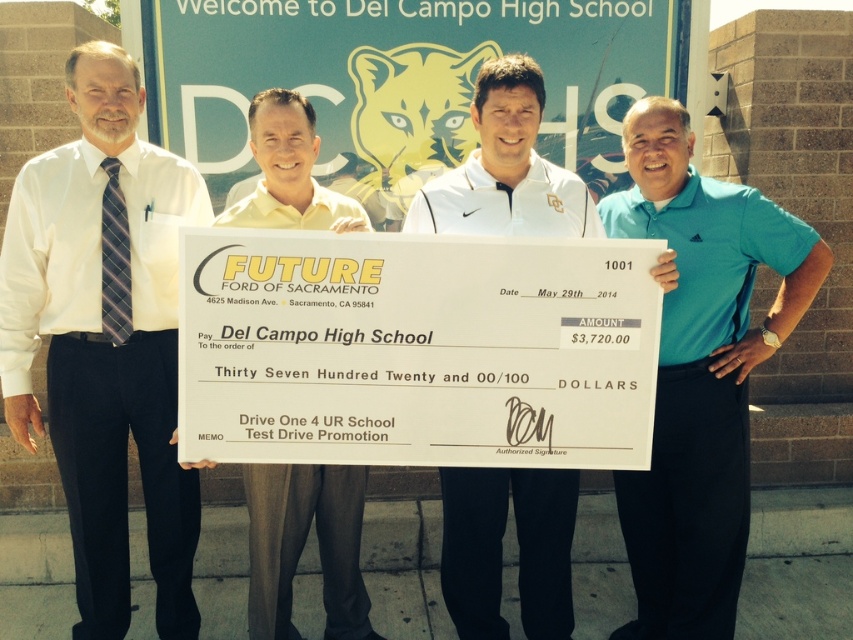
You are a photographer at the event and need to ensure both the white shirt at left and the white matte shirt at center are visible in the photo. Based on their positions, which shirt should you focus on first to capture both in the frame?

The white shirt at left is located above the white matte shirt at center, so focusing on the white shirt at left first will ensure both are visible in the frame since it is positioned higher up.